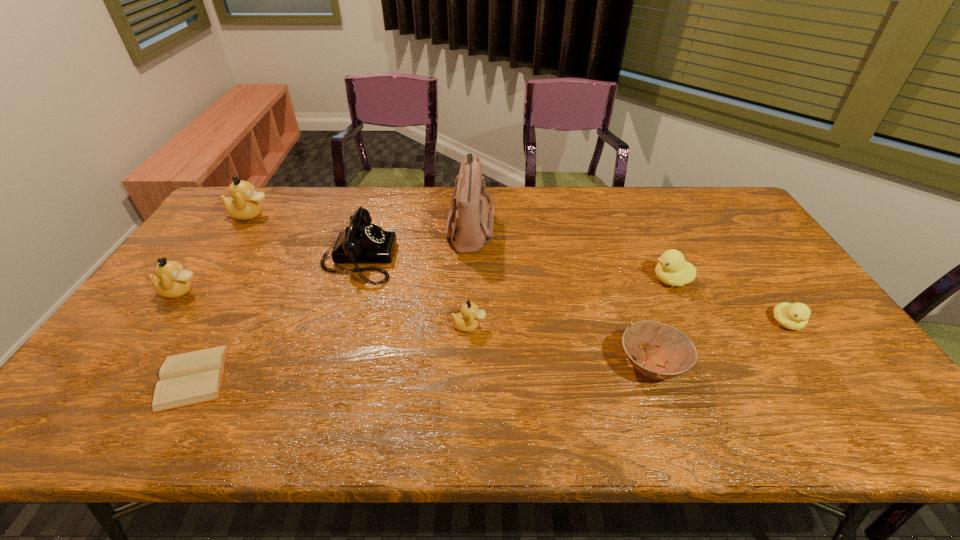
Where is `vacant area that lies between the black telephone and the shortest object`? The height and width of the screenshot is (540, 960). vacant area that lies between the black telephone and the shortest object is located at coordinates (276, 318).

This screenshot has width=960, height=540. I want to click on unoccupied area between the tallest object and the second object from right to left, so click(x=571, y=253).

Locate an element on the screen. The width and height of the screenshot is (960, 540). free space between the second nearest tan duckling and the black telephone is located at coordinates (269, 275).

Where is `free space between the rightmost tan duckling and the second farthest tan duckling`? Image resolution: width=960 pixels, height=540 pixels. free space between the rightmost tan duckling and the second farthest tan duckling is located at coordinates (324, 308).

Locate an element on the screen. This screenshot has width=960, height=540. vacant point located between the shortest object and the black telephone is located at coordinates (276, 318).

You are a GUI agent. You are given a task and a screenshot of the screen. Output one action in this format:
    pyautogui.click(x=<x>, y=<y>)
    Task: Click on the vacant area between the second nearest tan duckling and the black telephone
    The width and height of the screenshot is (960, 540).
    Given the screenshot: What is the action you would take?
    pyautogui.click(x=269, y=275)

What are the coordinates of `free space between the farther yellow duckling and the second nearest tan duckling` in the screenshot? It's located at (425, 286).

In order to click on free space that is in between the tallest object and the black telephone in this screenshot , I will do `click(415, 242)`.

Locate an element on the screen. The image size is (960, 540). free space between the black telephone and the diary is located at coordinates (276, 318).

Locate which object is the third closest to the bowl. Please provide its 2D coordinates. Your answer should be formatted as a tuple, i.e. [(x, y)], where the tuple contains the x and y coordinates of a point satisfying the conditions above.

[(467, 320)]